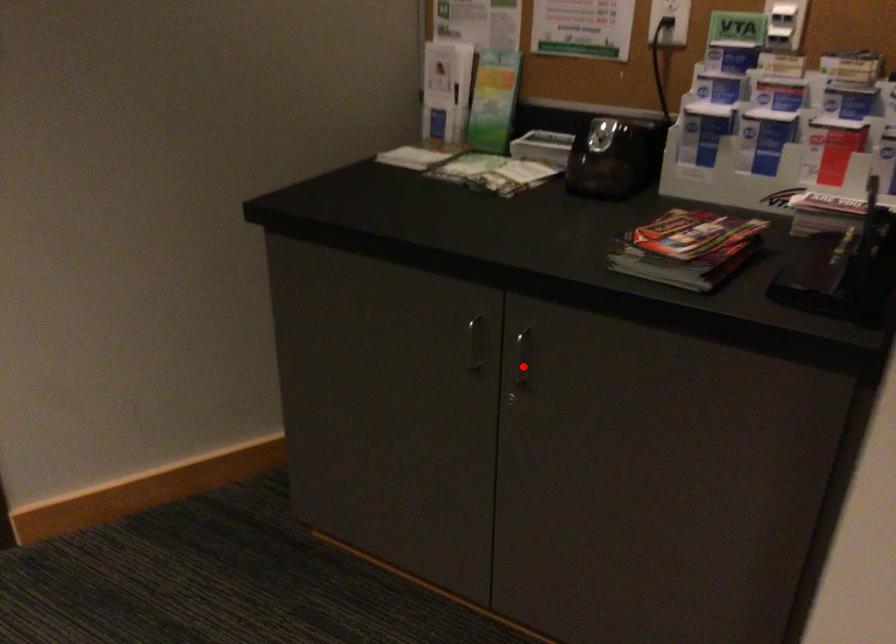
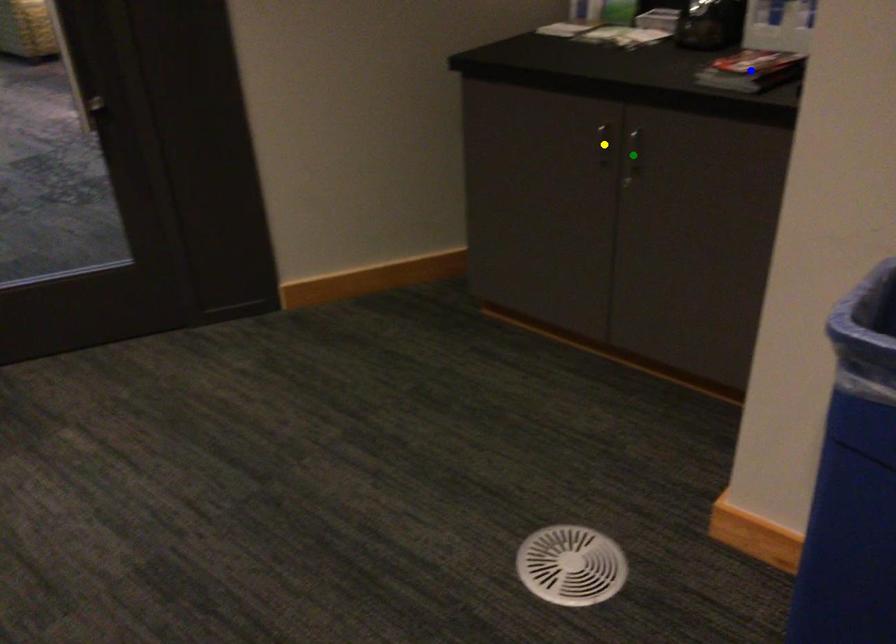
Question: I am providing you with two images of the same scene from different viewpoints. A red point is marked on the first image. You are given multiple points on the second image. Which point in image 2 represents the same 3d spot as the red point in image 1?

Choices:
 (A) blue point
 (B) yellow point
 (C) green point

Answer: (C)